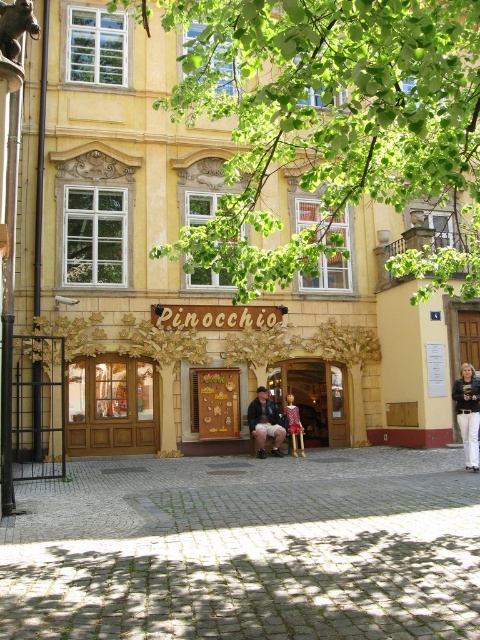
You are standing in front of the Pinocchio building and want to take a photo of the green leafy tree at upper center. If your camera has a maximum focus range of 4 meters, will it be able to capture the tree clearly?

The green leafy tree at upper center is 4.24 meters away from the camera. Since the camera can only focus up to 4 meters, it won cannot capture the tree clearly. You might need to move closer or use a different camera with a longer focus range.

You are an interior designer planning to place a large sofa in the space where the bronze statue at upper left and the matte pink dress at center are located. Based on their sizes, which object should you consider removing to make space for the sofa?

The bronze statue at upper left should be removed because it occupies less space than the matte pink dress at center, making it easier to relocate to accommodate the sofa.